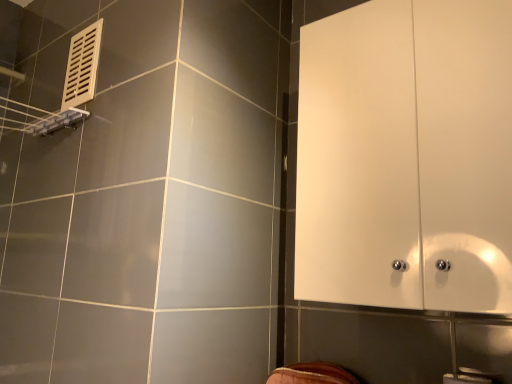
Image resolution: width=512 pixels, height=384 pixels. What do you see at coordinates (406, 155) in the screenshot?
I see `white matte cabinet at right` at bounding box center [406, 155].

This screenshot has height=384, width=512. In order to click on white matte cabinet at right in this screenshot , I will do `click(406, 155)`.

Find the location of `white matte cabinet at right`. white matte cabinet at right is located at coordinates (406, 155).